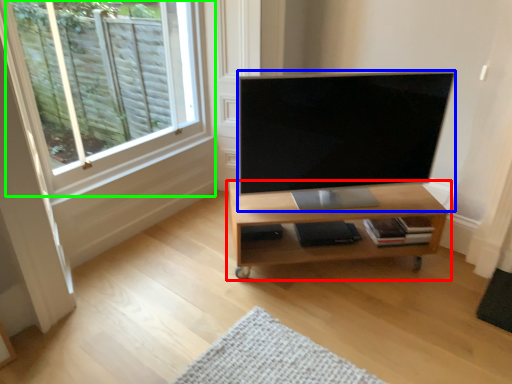
Question: Based on their relative distances, which object is farther from shelf (highlighted by a red box)? Choose from television (highlighted by a blue box) and window (highlighted by a green box).

Choices:
 (A) television
 (B) window

Answer: (B)